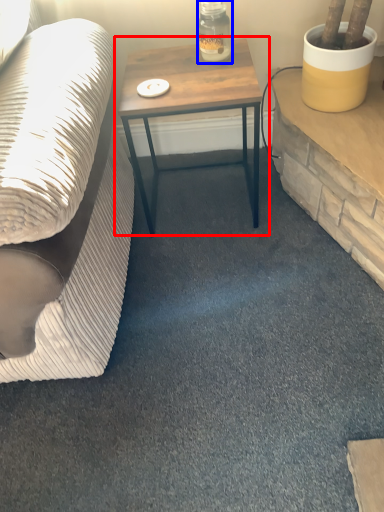
Question: Which object appears closest to the camera in this image, table (highlighted by a red box) or bottle (highlighted by a blue box)?

Choices:
 (A) table
 (B) bottle

Answer: (A)